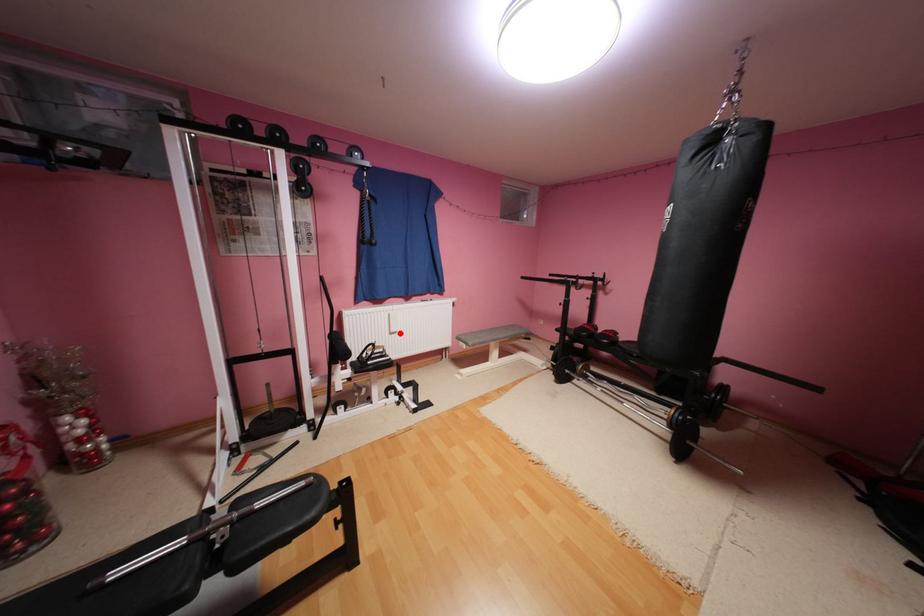
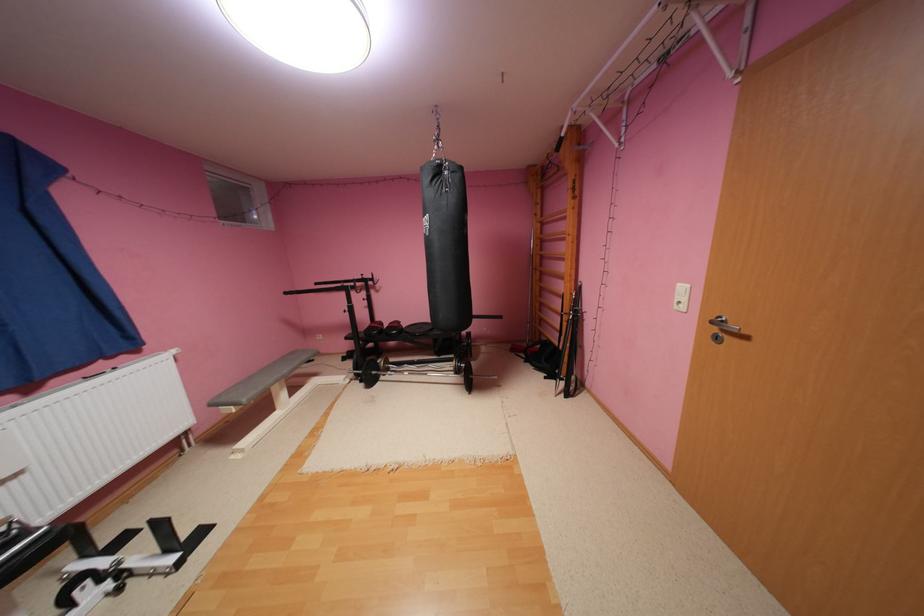
In the second image, find the point that corresponds to the highlighted location in the first image.

(11, 483)